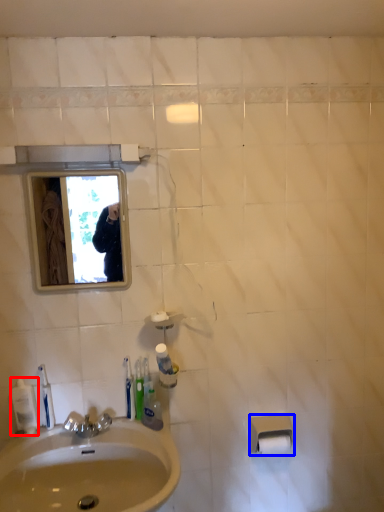
Question: Among these objects, which one is farthest to the camera, mouthwash (highlighted by a red box) or toilet paper (highlighted by a blue box)?

Choices:
 (A) mouthwash
 (B) toilet paper

Answer: (B)